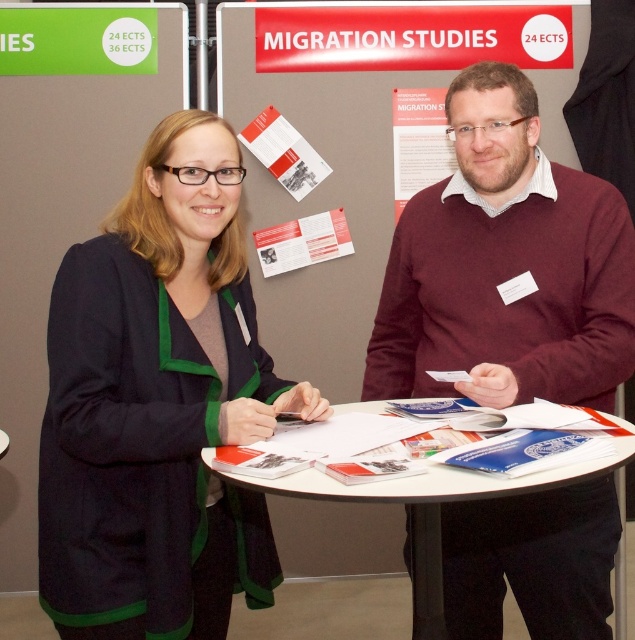
You are at the Migration Studies booth and need to place a new 18 ECTS course flyer between the maroon sweater at center and the matte paper poster at center. Since the flyer is 30 cm wide, will it fit in the space between them?

The maroon sweater at center is narrower than the matte paper poster at center. However, the exact width of the space between them isn not specified. The Objects Description only states the sweater is narrower than the poster, but without knowing the poster width or the distance between them, we cannot determine if the 30 cm flyer will fit.

You are at the Migration Studies booth and need to take notes. The booth has a white paper poster at upper center and a matte paper brochure at upper center. Which item can you fold more easily?

The white paper poster at upper center is thinner than the matte paper brochure at upper center, so it can be folded more easily.